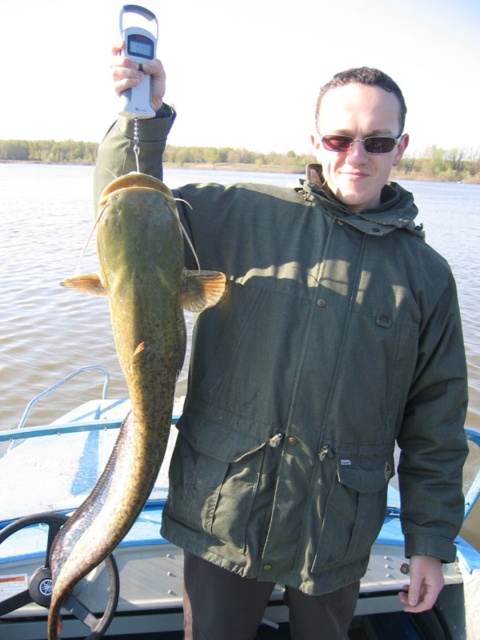
You are an observer on the shore looking at the blue plastic boat at center and the green scaly fish at left. Which object is positioned to the left of the other?

The blue plastic boat at center is to the left of the green scaly fish at left.

You are a photographer positioned at the center of the image. You need to capture a photo that includes both the point at coordinates point (295,563) and point (25,536). Based on their positions, which point should you focus on first to ensure both are in frame?

Point (295,563) is in front of point (25,536), so you should focus on point (295,563) first to ensure both are in frame.

You are a photographer positioned behind the person on the boat and want to take a clear photo of the green matte jacket at center and the blue plastic boat at center. Which object will appear larger in your photo?

The green matte jacket at center will appear larger in the photo because it is closer to the viewer than the blue plastic boat at center.